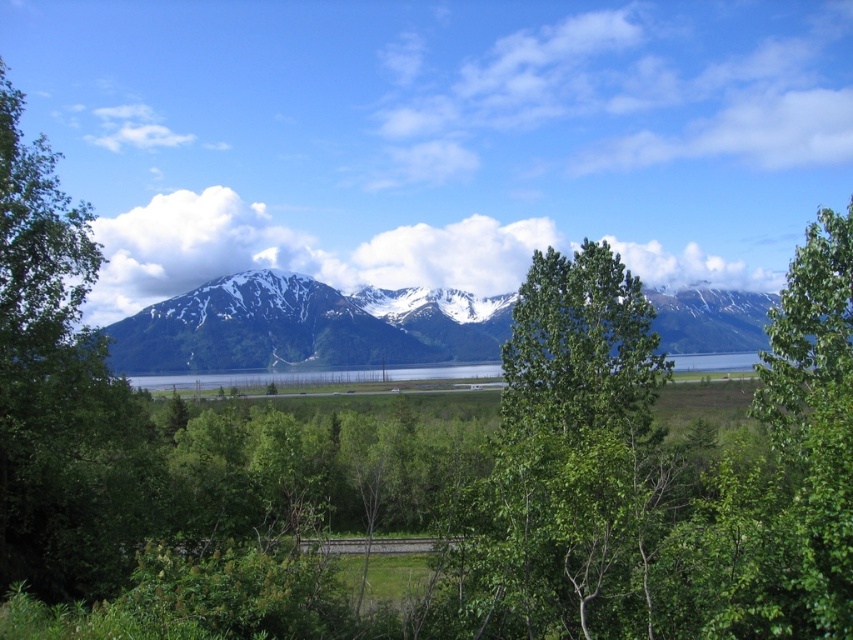
Does green leafy tree at upper right have a lesser height compared to clear water at center?

No, green leafy tree at upper right is not shorter than clear water at center.

Can you confirm if green leafy tree at upper right is positioned to the right of clear water at center?

Indeed, green leafy tree at upper right is positioned on the right side of clear water at center.

This screenshot has height=640, width=853. What do you see at coordinates (816, 412) in the screenshot? I see `green leafy tree at upper right` at bounding box center [816, 412].

The image size is (853, 640). In order to click on green leafy tree at upper right in this screenshot , I will do `click(816, 412)`.

Which is below, green leafy tree at center or clear water at center?

green leafy tree at center is below.

Can you confirm if green leafy tree at center is positioned below clear water at center?

Correct, green leafy tree at center is located below clear water at center.

The width and height of the screenshot is (853, 640). Identify the location of green leafy tree at center. (573, 456).

Is snowy rocky mountain range at center shorter than clear water at center?

No, snowy rocky mountain range at center is not shorter than clear water at center.

Does snowy rocky mountain range at center have a larger size compared to clear water at center?

Indeed, snowy rocky mountain range at center has a larger size compared to clear water at center.

Is point (461, 308) farther from viewer compared to point (480, 371)?

Yes, it is behind point (480, 371).

At what (x,y) coordinates should I click in order to perform the action: click on snowy rocky mountain range at center. Please return your answer as a coordinate pair (x, y). Image resolution: width=853 pixels, height=640 pixels. Looking at the image, I should click on (305, 326).